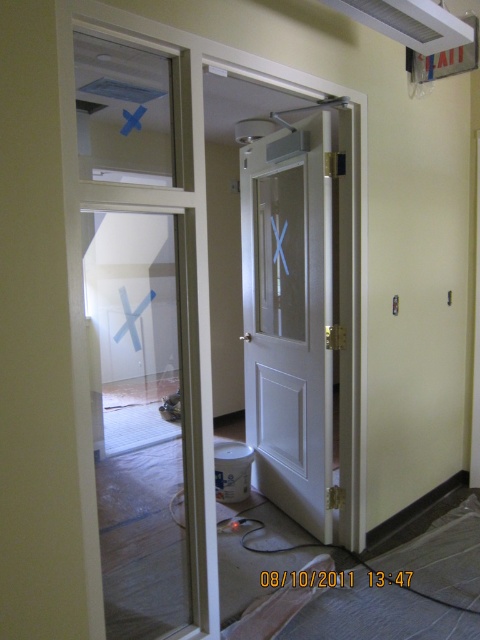
You are a delivery person who needs to enter the room through the clear glass door at center or the white glossy door at center. The delivery cart you are pushing is 70 centimeters wide. Which door can you use to enter without damaging the cart or the doors?

The clear glass door at center and white glossy door at center are 69.05 centimeters apart. Since the delivery cart is 70 centimeters wide, it cannot fit through the 69.05 cm gap between the doors. Therefore, you cannot use either door to enter without risking damage.

You are a construction worker who needs to enter the room through one of the doors. The clear glass door at center and the white glossy door at center are both partially open. Which door should you choose if you want to go through the wider entrance?

The clear glass door at center is bigger than the white glossy door at center, so you should choose the clear glass door at center as it has a wider entrance.